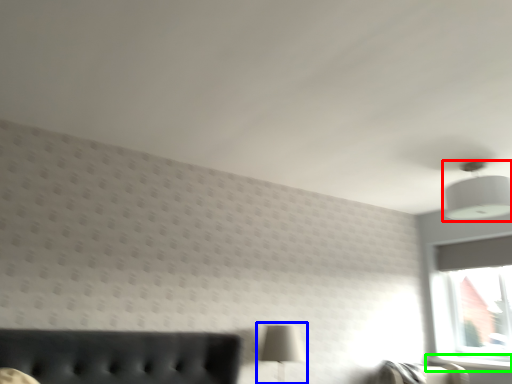
Question: Which is farther away from lamp (highlighted by a red box)? table lamp (highlighted by a blue box) or window sill (highlighted by a green box)?

Choices:
 (A) table lamp
 (B) window sill

Answer: (B)